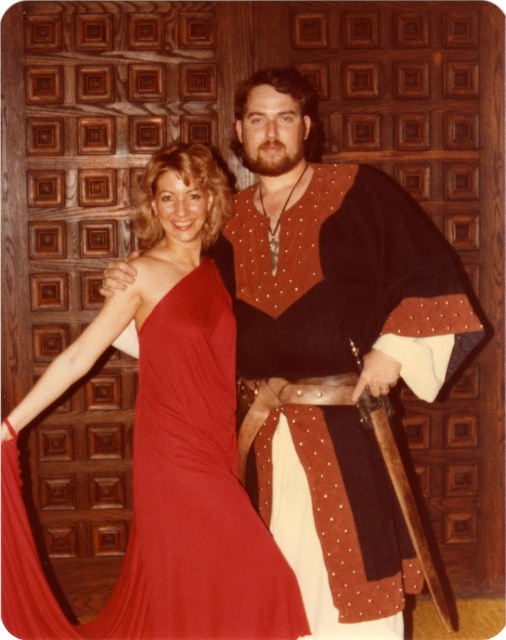
Question: Which object appears farthest from the camera in this image?

Choices:
 (A) suede-like vest at center
 (B) shiny satin dress at center

Answer: (A)

Question: Which of the following is the closest to the observer?

Choices:
 (A) (278, 541)
 (B) (157, 164)

Answer: (A)

Question: Is suede-like vest at center closer to the viewer compared to shiny satin dress at center?

Choices:
 (A) yes
 (B) no

Answer: (B)

Question: Observing the image, what is the correct spatial positioning of suede-like vest at center in reference to shiny satin dress at center?

Choices:
 (A) above
 (B) below

Answer: (A)

Question: Can you confirm if suede-like vest at center is bigger than shiny satin dress at center?

Choices:
 (A) yes
 (B) no

Answer: (A)